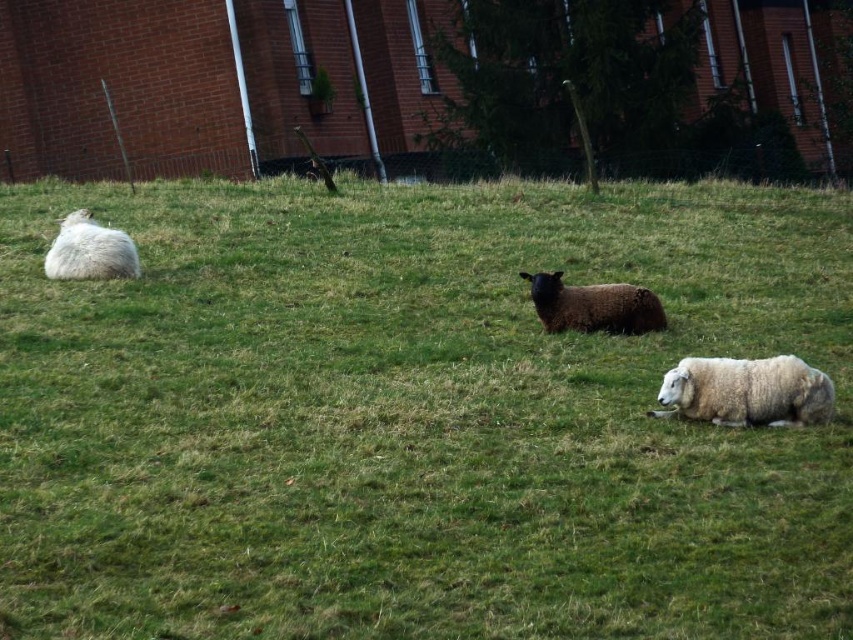
You are a photographer standing in the grassy field and want to take a picture of the dark brown woolly sheep at center and the white fluffy sheep at left. Which sheep is closer to the right edge of your camera frame?

The dark brown woolly sheep at center is positioned on the right side of white fluffy sheep at left, so it is closer to the right edge of the camera frame.

You are standing at the brick building in the background and looking towards the field. Which of the two points, point A at coordinates point (596, 330) or point B at coordinates point (82, 212), is closer to you?

Point B at coordinates point (82, 212) is closer to you because it is behind point A at coordinates point (596, 330).